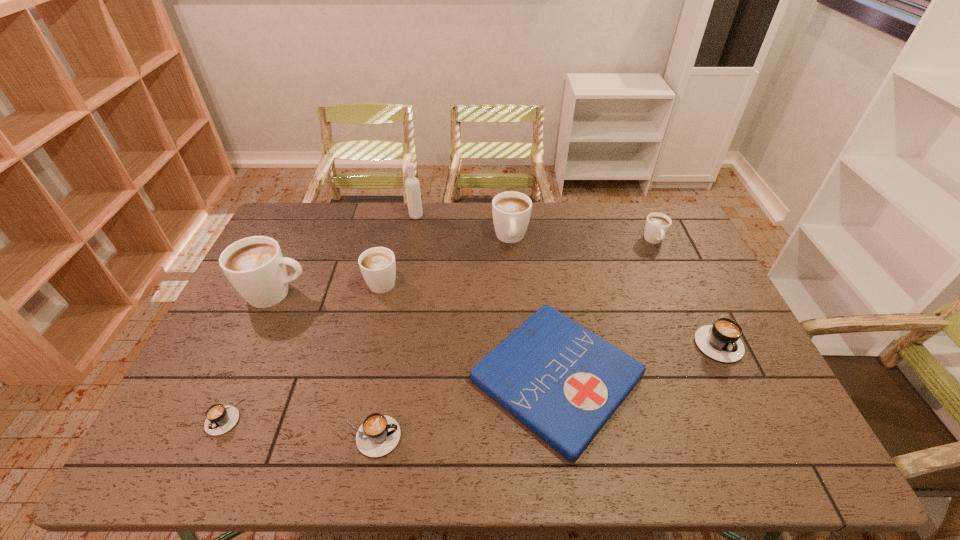
Locate an element on the screen. free region located with the handle on the side of the third biggest white cappuccino is located at coordinates (399, 207).

The image size is (960, 540). I want to click on free region located with the handle on the side of the third biggest white cappuccino, so click(x=390, y=248).

Locate an element on the screen. Image resolution: width=960 pixels, height=540 pixels. free region located 0.250m with the handle on the side of the third biggest white cappuccino is located at coordinates (396, 221).

The image size is (960, 540). I want to click on vacant position located 0.270m with the handle on the side of the smallest white cappuccino, so click(684, 308).

Locate an element on the screen. vacant space situated 0.240m with the handle on the side of the fifth farthest cappuccino is located at coordinates (769, 450).

Identify the location of free location located with the handle on the side of the second biggest black cappuccino. This screenshot has height=540, width=960. [x=523, y=437].

Locate an element on the screen. vacant space located 0.060m on the back of the blue first-aid kit is located at coordinates (545, 298).

At what (x,y) coordinates should I click in order to perform the action: click on vodka that is at the far edge. Please return your answer as a coordinate pair (x, y). The height and width of the screenshot is (540, 960). Looking at the image, I should click on (412, 185).

Locate an element on the screen. the first-aid kit that is at the near edge is located at coordinates (563, 382).

Locate an element on the screen. object that is at the near left corner is located at coordinates (219, 419).